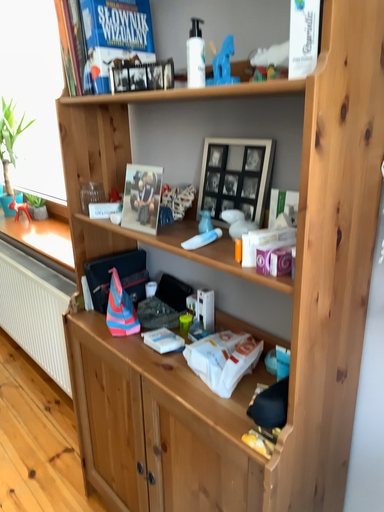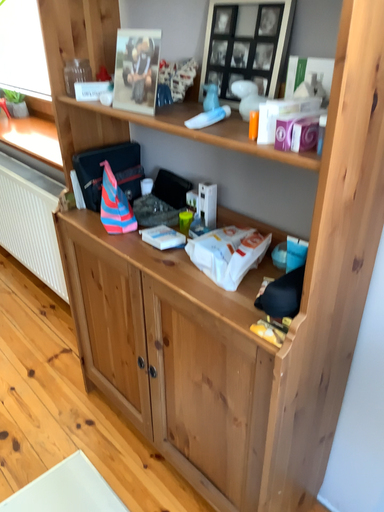
Question: How did the camera likely rotate when shooting the video?

Choices:
 (A) rotated downward
 (B) rotated upward

Answer: (A)